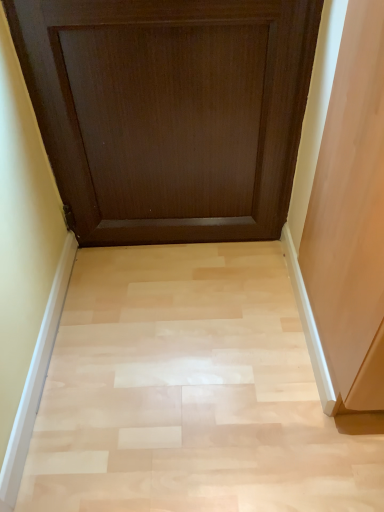
Locate an element on the screen. Image resolution: width=384 pixels, height=512 pixels. vacant space in dark wood door at upper center (from a real-world perspective) is located at coordinates (180, 262).